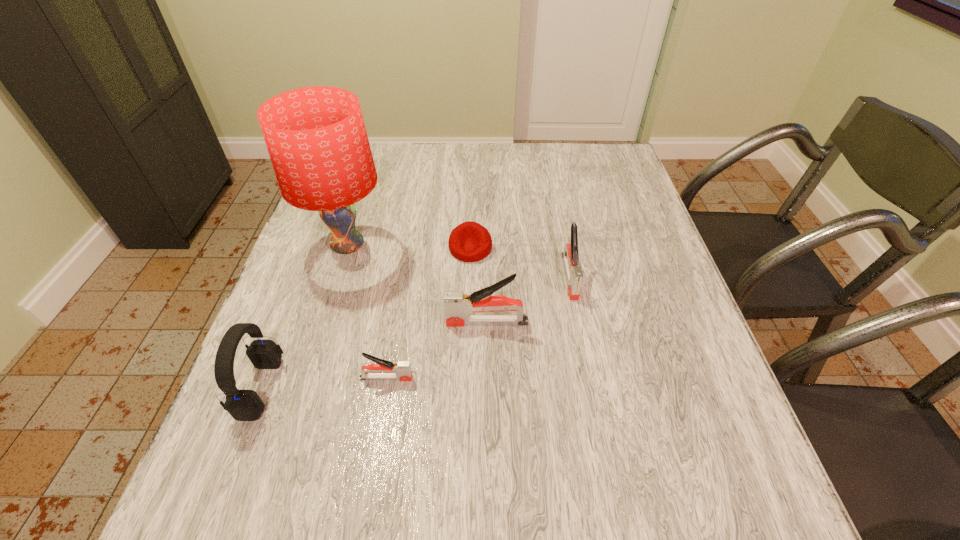
Where is `object present at the near left corner`? object present at the near left corner is located at coordinates (243, 405).

Where is `vacant space at the far edge`? Image resolution: width=960 pixels, height=540 pixels. vacant space at the far edge is located at coordinates (563, 165).

You are a GUI agent. You are given a task and a screenshot of the screen. Output one action in this format:
    pyautogui.click(x=<x>, y=<y>)
    Task: Click on the free region at the near edge of the desktop
    
    Given the screenshot: What is the action you would take?
    pyautogui.click(x=515, y=429)

In the image, there is a desktop. Identify the location of free space at the left edge. This screenshot has width=960, height=540. (305, 303).

In order to click on vacant space at the right edge of the desktop in this screenshot , I will do `click(654, 293)`.

Locate an element on the screen. vacant space at the far right corner of the desktop is located at coordinates tap(590, 156).

The width and height of the screenshot is (960, 540). In the image, there is a desktop. Find the location of `free space at the near right corner`. free space at the near right corner is located at coordinates (708, 445).

Image resolution: width=960 pixels, height=540 pixels. I want to click on unoccupied area between the third nearest object and the headset, so click(x=374, y=355).

Find the location of a particular element. The image size is (960, 540). empty space between the shortest stapler and the beanbag is located at coordinates (428, 313).

Where is `unoccupied area between the shortest object and the fourth farthest object`? The image size is (960, 540). unoccupied area between the shortest object and the fourth farthest object is located at coordinates (479, 285).